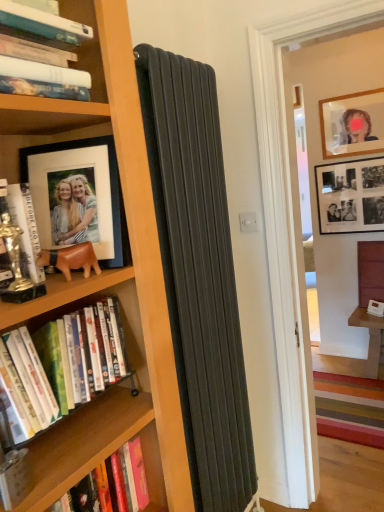
Question: Does black matte photo frame at upper right, which is the 3th picture frame in left-to-right order, contain hardcover books at left, placed as the 3th book when sorted from top to bottom?

Choices:
 (A) no
 (B) yes

Answer: (A)

Question: Considering the relative sizes of black matte photo frame at upper right, marked as the 1th picture frame in a back-to-front arrangement, and hardcover books at left, placed as the 3th book when sorted from top to bottom, in the image provided, is black matte photo frame at upper right, marked as the 1th picture frame in a back-to-front arrangement, smaller than hardcover books at left, placed as the 3th book when sorted from top to bottom,?

Choices:
 (A) yes
 (B) no

Answer: (A)

Question: Does black matte photo frame at upper right, which is the 3th picture frame in left-to-right order, have a greater width compared to hardcover books at left, placed as the 3th book when sorted from top to bottom?

Choices:
 (A) yes
 (B) no

Answer: (B)

Question: From the image's perspective, would you say black matte photo frame at upper right, acting as the 2th picture frame starting from the bottom, is positioned over hardcover books at left, the second book from the bottom?

Choices:
 (A) no
 (B) yes

Answer: (B)

Question: Is black matte photo frame at upper right, which is the third picture frame from front to back, taller than hardcover books at left, placed as the 3th book when sorted from top to bottom?

Choices:
 (A) yes
 (B) no

Answer: (A)

Question: Is point (x=193, y=328) positioned closer to the camera than point (x=140, y=464)?

Choices:
 (A) farther
 (B) closer

Answer: (A)

Question: Visually, is matte black radiator at center positioned to the left or to the right of hardcover book at lower left, the 4th book in the top-to-bottom sequence?

Choices:
 (A) right
 (B) left

Answer: (A)

Question: From the image's perspective, is matte black radiator at center above or below hardcover book at lower left, the 4th book in the top-to-bottom sequence?

Choices:
 (A) below
 (B) above

Answer: (B)

Question: Is matte black radiator at center wider or thinner than hardcover book at lower left, the 4th book in the top-to-bottom sequence?

Choices:
 (A) wide
 (B) thin

Answer: (B)

Question: Considering the positions of matte glass picture frame at upper right, arranged as the 2th picture frame when viewed from the left, and hardcover book at left, the third book in the bottom-to-top sequence, in the image, is matte glass picture frame at upper right, arranged as the 2th picture frame when viewed from the left, bigger or smaller than hardcover book at left, the third book in the bottom-to-top sequence,?

Choices:
 (A) small
 (B) big

Answer: (B)

Question: From their relative heights in the image, would you say matte glass picture frame at upper right, marked as the 3th picture frame in a bottom-to-top arrangement, is taller or shorter than hardcover book at left, which appears as the 2th book when viewed from the top?

Choices:
 (A) short
 (B) tall

Answer: (B)

Question: Considering the positions of matte glass picture frame at upper right, the 2th picture frame positioned from the right, and hardcover book at left, the third book in the bottom-to-top sequence, in the image, is matte glass picture frame at upper right, the 2th picture frame positioned from the right, wider or thinner than hardcover book at left, the third book in the bottom-to-top sequence,?

Choices:
 (A) thin
 (B) wide

Answer: (A)

Question: Does point (364, 109) appear closer or farther from the camera than point (31, 226)?

Choices:
 (A) closer
 (B) farther

Answer: (B)

Question: Is point (337, 117) positioned closer to the camera than point (41, 249)?

Choices:
 (A) farther
 (B) closer

Answer: (A)

Question: In terms of height, does matte glass picture frame at upper right, arranged as the 2th picture frame when viewed from the front, look taller or shorter compared to leather-like brown bear at left?

Choices:
 (A) short
 (B) tall

Answer: (B)